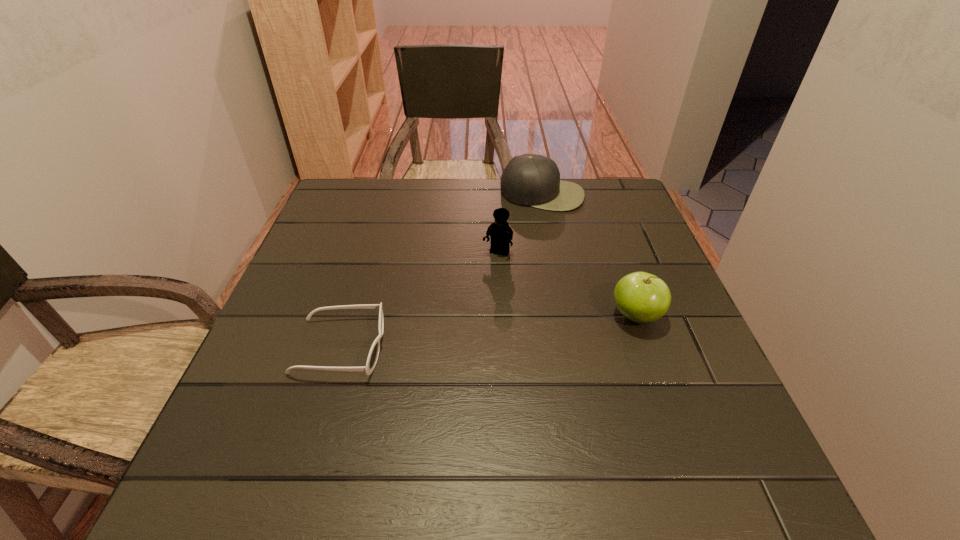
Image resolution: width=960 pixels, height=540 pixels. I want to click on sunglasses, so click(x=373, y=354).

Locate an element on the screen. This screenshot has height=540, width=960. the shortest object is located at coordinates (373, 354).

Locate an element on the screen. The height and width of the screenshot is (540, 960). apple is located at coordinates (641, 297).

I want to click on the third nearest object, so click(501, 234).

At what (x,y) coordinates should I click in order to perform the action: click on the farthest object. Please return your answer as a coordinate pair (x, y). Looking at the image, I should click on (533, 180).

Identify the location of vacant space located 0.290m with the lenses of the leftmost object facing outward. This screenshot has width=960, height=540. (527, 347).

Identify the location of vacant area situated on the left of the apple. Image resolution: width=960 pixels, height=540 pixels. (430, 316).

Where is `vacant region located 0.330m on the front-facing side of the third nearest object`? This screenshot has height=540, width=960. vacant region located 0.330m on the front-facing side of the third nearest object is located at coordinates pos(443,363).

In order to click on vacant position located 0.330m on the front-facing side of the third nearest object in this screenshot , I will do `click(443, 363)`.

Identify the location of free region located 0.260m on the front-facing side of the third nearest object. This screenshot has height=540, width=960. (456, 337).